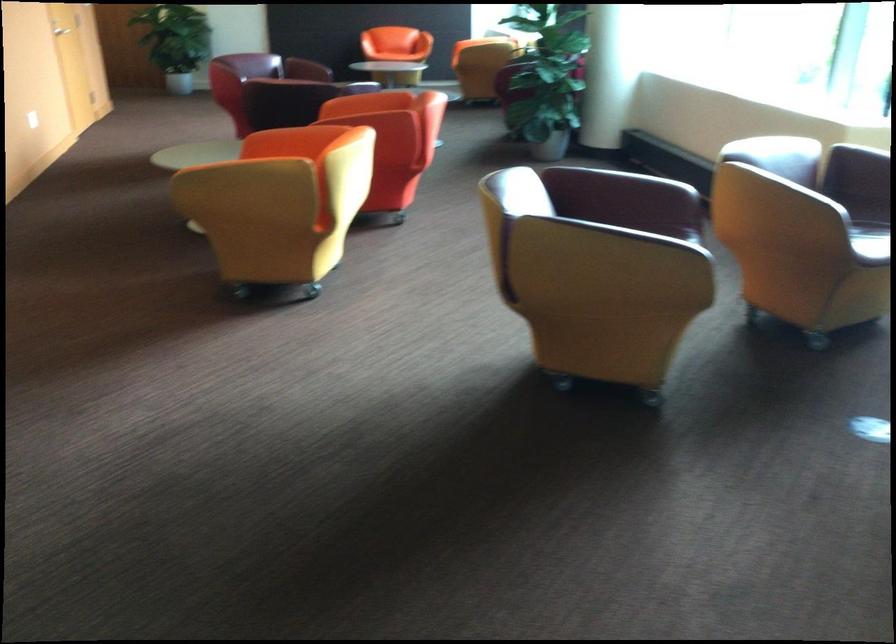
Describe the element at coordinates (868, 238) in the screenshot. This screenshot has width=896, height=644. I see `a purple chair sitting surface` at that location.